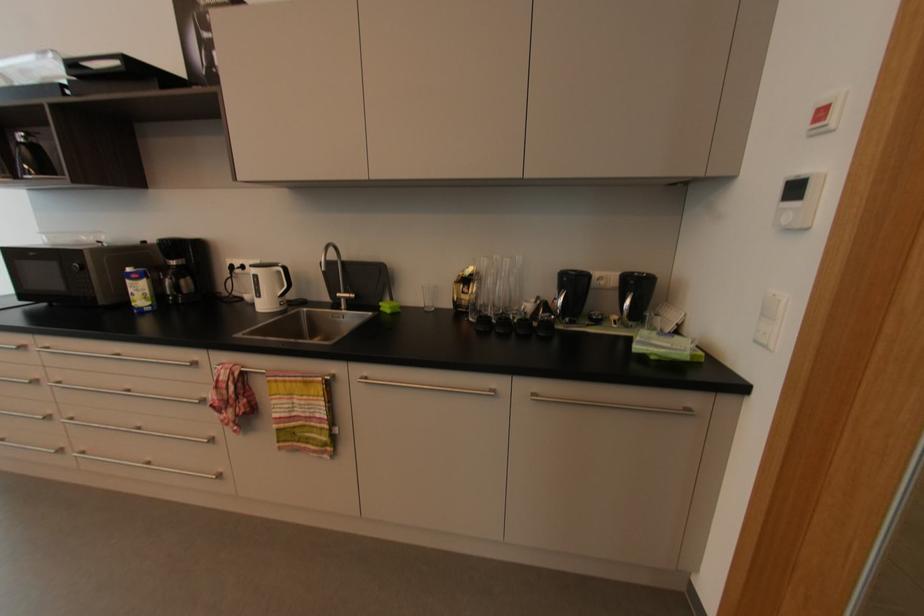
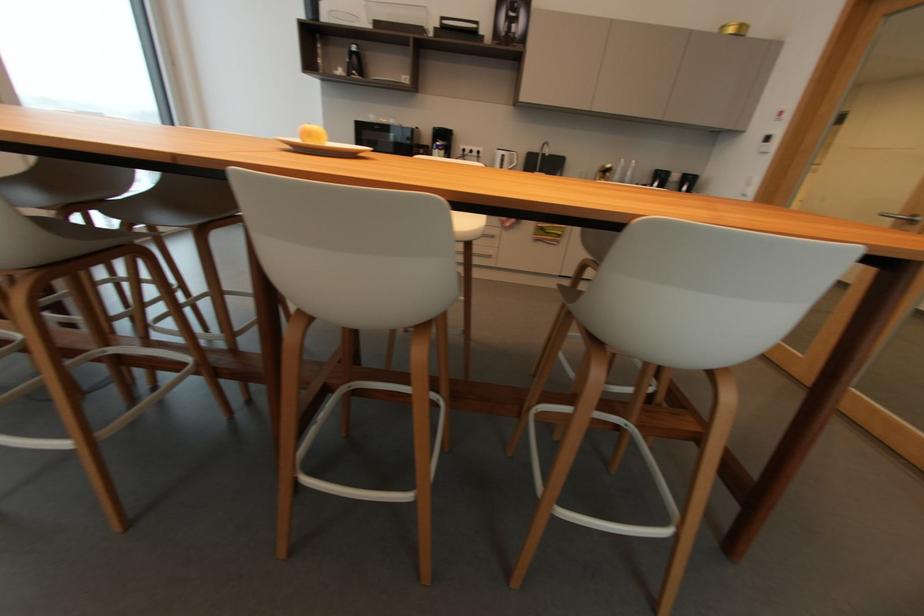
What movement of the cameraman would produce the second image?

The cameraman moved toward left, backward.